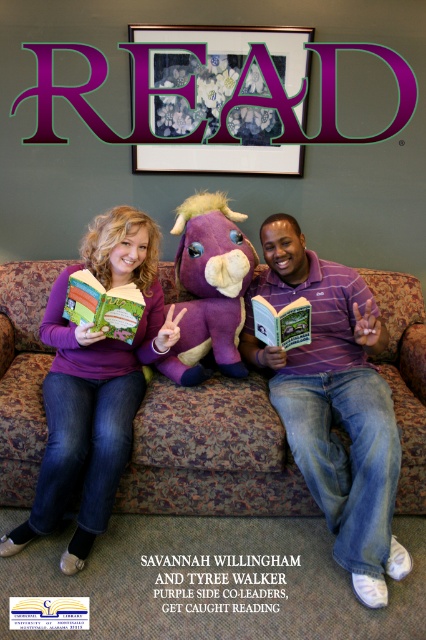
Question: In this image, where is hardcover book at center located relative to purple matte book at center?

Choices:
 (A) below
 (B) above

Answer: (B)

Question: In this image, where is brown floral fabric couch at center located relative to hardcover book at center?

Choices:
 (A) left
 (B) right

Answer: (B)

Question: Which of the following is the closest to the observer?

Choices:
 (A) coord(25,448)
 (B) coord(267,340)

Answer: (A)

Question: Among these points, which one is farthest from the camera?

Choices:
 (A) (304, 305)
 (B) (83, 320)

Answer: (A)

Question: Which point appears closest to the camera in this image?

Choices:
 (A) (71, 314)
 (B) (49, 336)
 (C) (31, 436)
 (D) (256, 337)

Answer: (C)

Question: Does purple soft sweater at center appear on the right side of purple matte book at center?

Choices:
 (A) no
 (B) yes

Answer: (A)